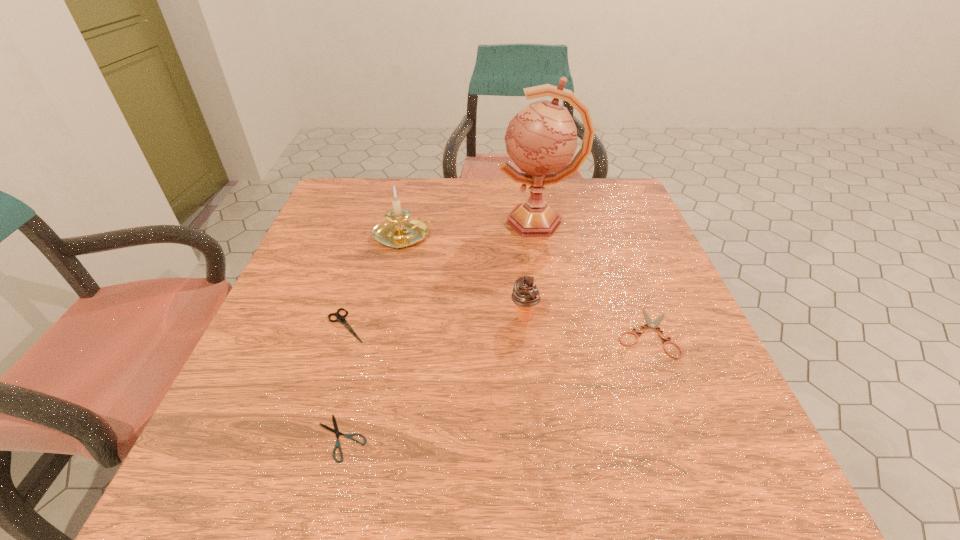
Locate an element on the screen. The image size is (960, 540). vacant space located 0.360m on the front-facing side of the globe is located at coordinates (362, 222).

This screenshot has width=960, height=540. Identify the location of vacant point located on the handle side of the candle holder. (513, 236).

Where is `vacant area situated 0.080m on the front of the icecream`? The image size is (960, 540). vacant area situated 0.080m on the front of the icecream is located at coordinates (528, 360).

The height and width of the screenshot is (540, 960). Identify the location of free spot located 0.210m on the back of the fourth tallest object. tap(370, 248).

At what (x,y) coordinates should I click in order to perform the action: click on vacant space situated on the left of the rightmost object. Please return your answer as a coordinate pair (x, y). The width and height of the screenshot is (960, 540). Looking at the image, I should click on click(x=431, y=332).

I want to click on vacant space situated 0.250m on the right of the nearest shears, so click(x=522, y=438).

The image size is (960, 540). In order to click on object that is at the far edge in this screenshot , I will do `click(542, 137)`.

At what (x,y) coordinates should I click in order to perform the action: click on object that is at the near edge. Please return your answer as a coordinate pair (x, y). This screenshot has width=960, height=540. Looking at the image, I should click on coord(336,431).

This screenshot has height=540, width=960. In order to click on object situated at the left edge in this screenshot , I will do `click(340, 318)`.

Image resolution: width=960 pixels, height=540 pixels. I want to click on object that is at the right edge, so click(x=654, y=324).